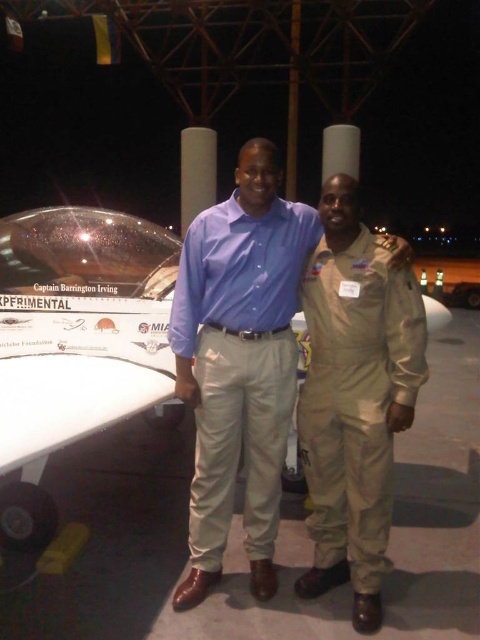
Question: Is white glossy airplane at center wider than tan/leather jumpsuit at center?

Choices:
 (A) yes
 (B) no

Answer: (A)

Question: Considering the real-world distances, which object is farthest from the white glossy airplane at center?

Choices:
 (A) tan/leather jumpsuit at center
 (B) matte blue shirt at center

Answer: (A)

Question: Which is nearer to the matte blue shirt at center?

Choices:
 (A) white glossy airplane at center
 (B) tan/leather jumpsuit at center

Answer: (B)

Question: Based on their relative distances, which object is farther from the white glossy airplane at center?

Choices:
 (A) matte blue shirt at center
 (B) tan/leather jumpsuit at center

Answer: (B)

Question: Can you confirm if white glossy airplane at center is positioned above tan/leather jumpsuit at center?

Choices:
 (A) yes
 (B) no

Answer: (A)

Question: Is white glossy airplane at center positioned in front of tan/leather jumpsuit at center?

Choices:
 (A) no
 (B) yes

Answer: (B)